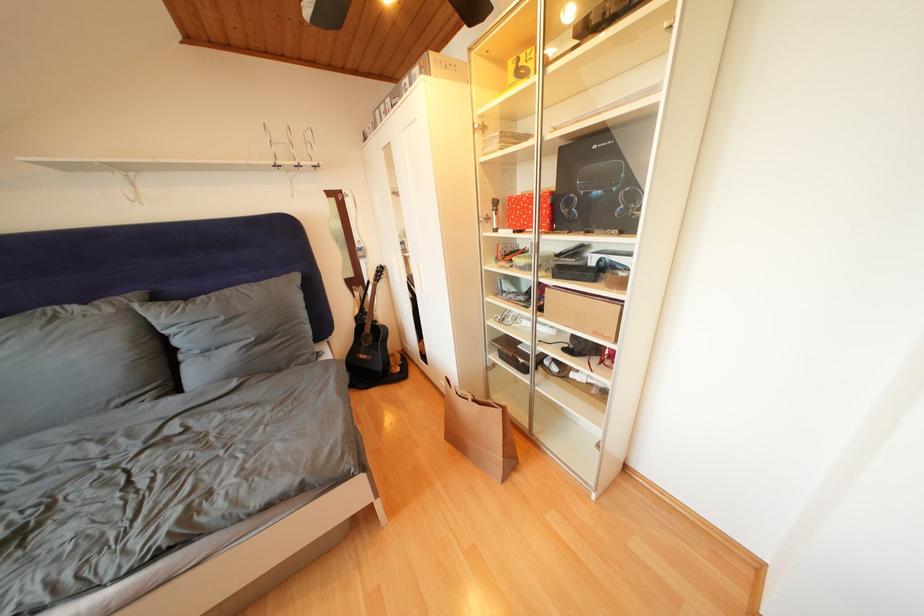
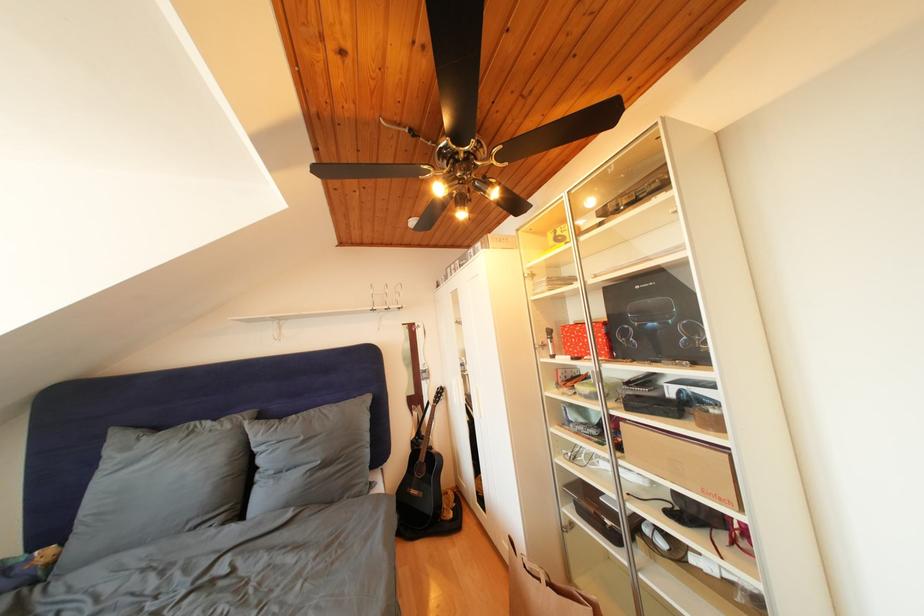
Question: The images are taken continuously from a first-person perspective. In which direction are you moving?

Choices:
 (A) Left
 (B) Right
 (C) Forward
 (D) Backward

Answer: (D)